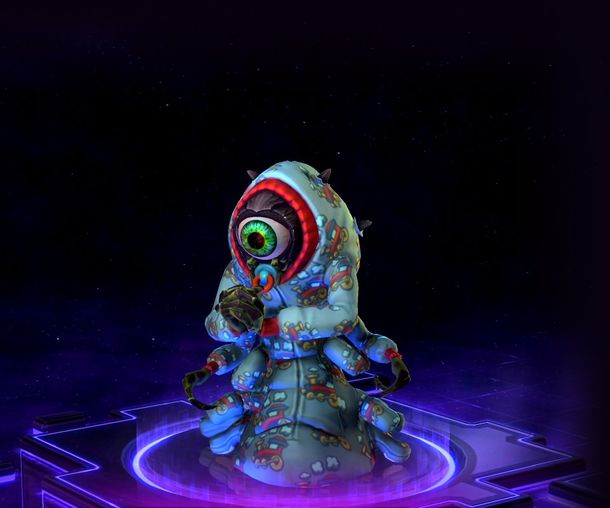
Image resolution: width=610 pixels, height=508 pixels. In order to click on pacifier in this screenshot , I will do `click(263, 273)`.